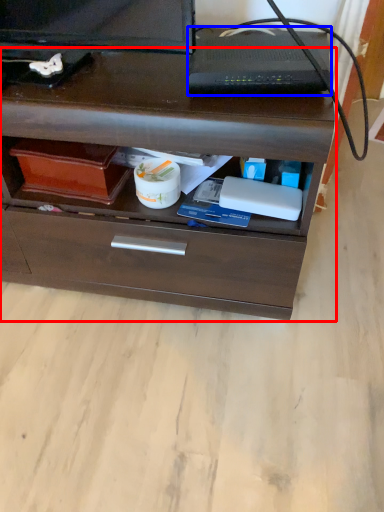
Question: Which point is closer to the camera, chest of drawers (highlighted by a red box) or appliance (highlighted by a blue box)?

Choices:
 (A) chest of drawers
 (B) appliance

Answer: (A)